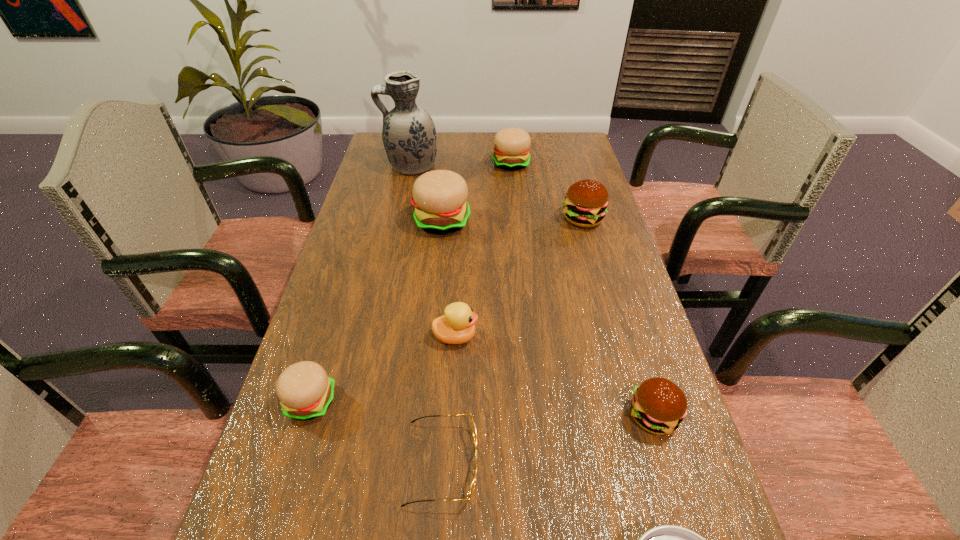
This screenshot has width=960, height=540. What are the coordinates of `free space located on the front-facing side of the gold spectacles` in the screenshot? It's located at (535, 463).

The height and width of the screenshot is (540, 960). I want to click on vase that is at the far edge, so click(409, 136).

Identify the location of hamburger that is at the far edge. (512, 145).

Image resolution: width=960 pixels, height=540 pixels. What are the coordinates of `vase that is at the left edge` in the screenshot? It's located at (409, 136).

At what (x,y) coordinates should I click in order to perform the action: click on hamburger located at the left edge. Please return your answer as a coordinate pair (x, y). The height and width of the screenshot is (540, 960). Looking at the image, I should click on (305, 391).

Where is `object that is at the far left corner`? The height and width of the screenshot is (540, 960). object that is at the far left corner is located at coordinates (409, 136).

Locate an element on the screen. Image resolution: width=960 pixels, height=540 pixels. vacant space at the far edge of the desktop is located at coordinates (444, 135).

The image size is (960, 540). What are the coordinates of `vacant space at the left edge of the desktop` in the screenshot? It's located at (348, 374).

What are the coordinates of `vacant space at the right edge of the desktop` in the screenshot? It's located at (651, 441).

At what (x,y) coordinates should I click in order to perform the action: click on free space at the far left corner. Please return your answer as a coordinate pair (x, y). Image resolution: width=960 pixels, height=540 pixels. Looking at the image, I should click on (376, 141).